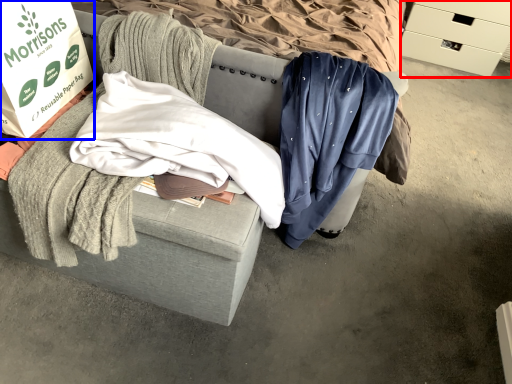
Question: Which point is closer to the camera, drawer (highlighted by a red box) or box (highlighted by a blue box)?

Choices:
 (A) drawer
 (B) box

Answer: (B)